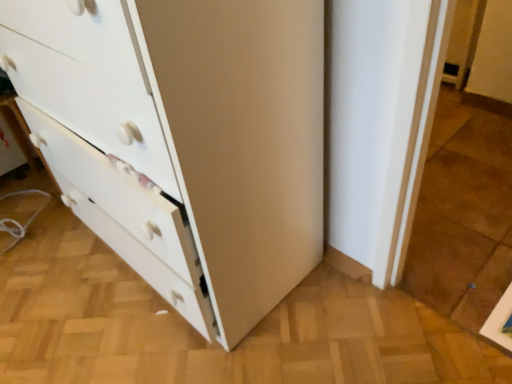
The width and height of the screenshot is (512, 384). In order to click on free space to the left of white glossy chest of drawers at lower left in this screenshot , I will do `click(53, 268)`.